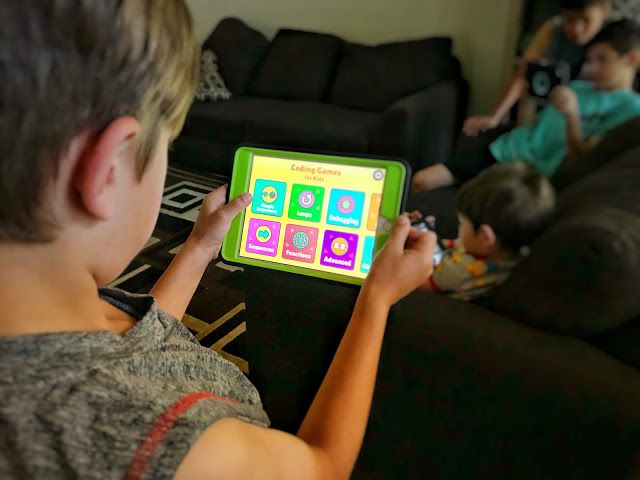
Locate an element on the screen. This screenshot has height=480, width=640. living room area rug is located at coordinates (175, 228).